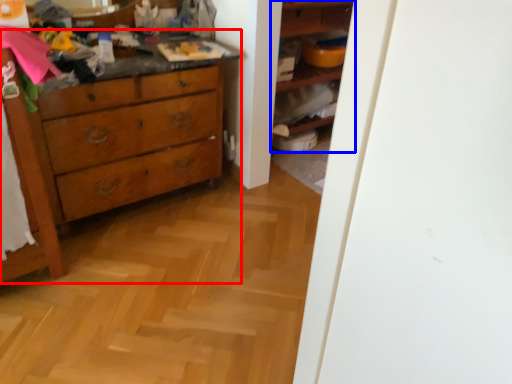
Question: Which point is further to the camera, chest of drawers (highlighted by a red box) or shelf (highlighted by a blue box)?

Choices:
 (A) chest of drawers
 (B) shelf

Answer: (B)